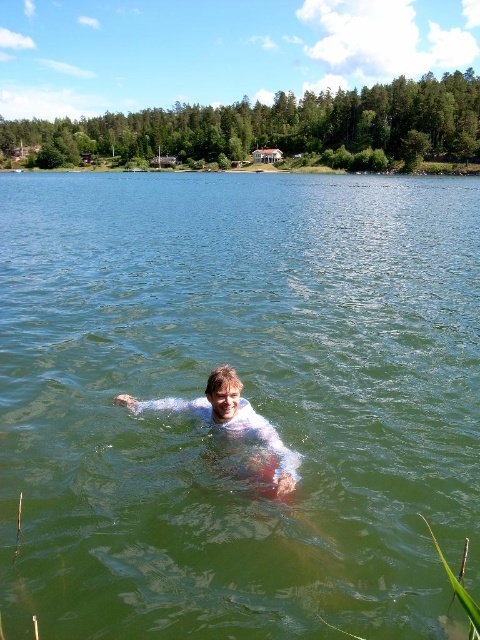
You are a drone operator trying to capture a photo of the person swimming in the lake. The drone is currently positioned at point 0.5, 0.5. To ensure the person is in the frame, you need to adjust the drone to face the green liquid water at center. According to the coordinates provided, should you adjust the drone to the left or right?

The green liquid water at center is located at point [244,394], which is to the right of the drone at [240,320]. Therefore, you should adjust the drone to the right to face the green liquid water at center.

You are a photographer planning to take a portrait of the person in the lake. Given that the green liquid water at center and the white matte skin at center are both in the frame, which object occupies more horizontal space in the photo?

The green liquid water at center occupies more horizontal space in the photo because its width is larger than that of the white matte skin at center.

You are a photographer trying to capture the entire scene of the green liquid water at center and the white matte skin at center in one shot. Based on their sizes, which object will occupy more space in the photo?

The green liquid water at center is bigger than the white matte skin at center, so it will occupy more space in the photo.